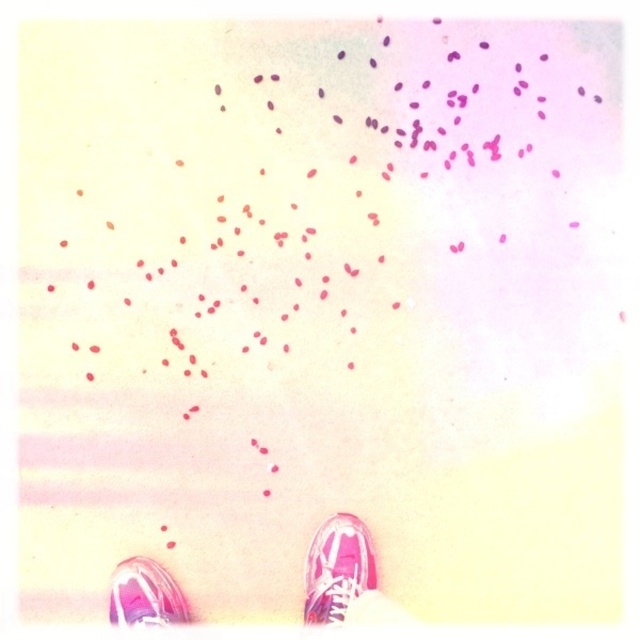
Based on the photo, can you confirm if pink canvas shoes at lower center is bigger than pink glossy shoe at lower left?

Yes, pink canvas shoes at lower center is bigger than pink glossy shoe at lower left.

Image resolution: width=640 pixels, height=640 pixels. I want to click on pink canvas shoes at lower center, so click(342, 577).

Is point (179, 600) closer to viewer compared to point (147, 557)?

Yes, it is in front of point (147, 557).

Find the location of a particular element. pink canvas shoes at lower center is located at coordinates (342, 577).

Looking at this image, is pink canvas shoes at lower center further to camera compared to pink canvas shoe at lower right?

No, it is not.

You are a GUI agent. You are given a task and a screenshot of the screen. Output one action in this format:
    pyautogui.click(x=<x>, y=<y>)
    Task: Click on the pink canvas shoes at lower center
    This screenshot has height=640, width=640.
    Given the screenshot: What is the action you would take?
    pyautogui.click(x=342, y=577)

Who is more distant from viewer, (305, 614) or (122, 595)?

Point (305, 614)

Is point (320, 532) positioned after point (122, 592)?

Yes, it is behind point (122, 592).

Which is behind, point (365, 545) or point (179, 588)?

Positioned behind is point (365, 545).

Where is `pink canvas shoe at lower right`? This screenshot has height=640, width=640. pink canvas shoe at lower right is located at coordinates (337, 568).